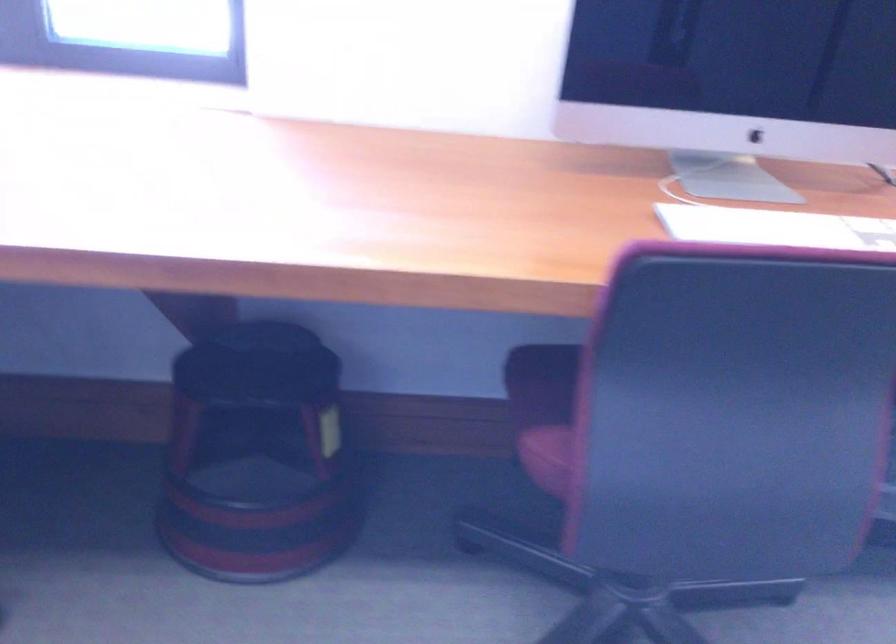
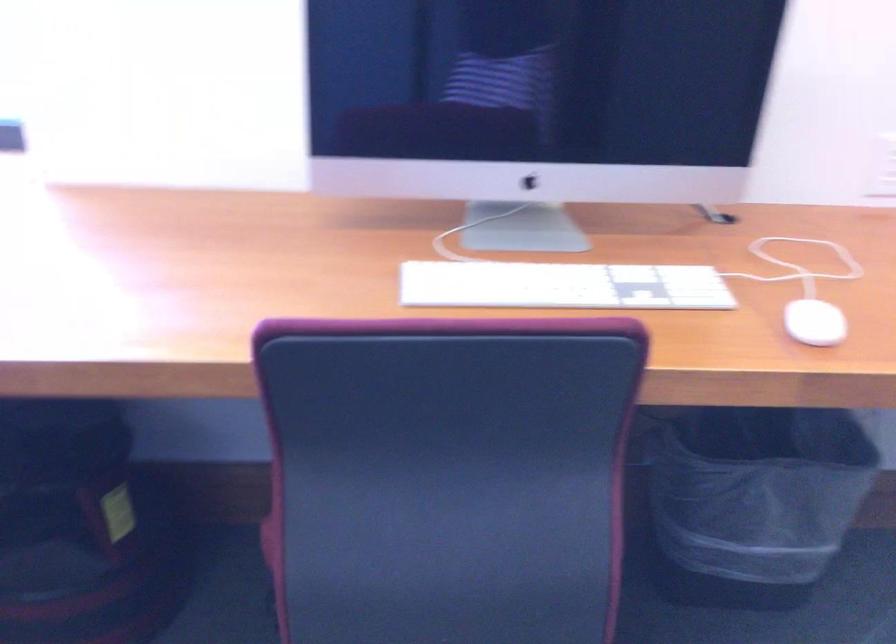
Where in the second image is the point corresponding to point (814, 228) from the first image?

(562, 285)